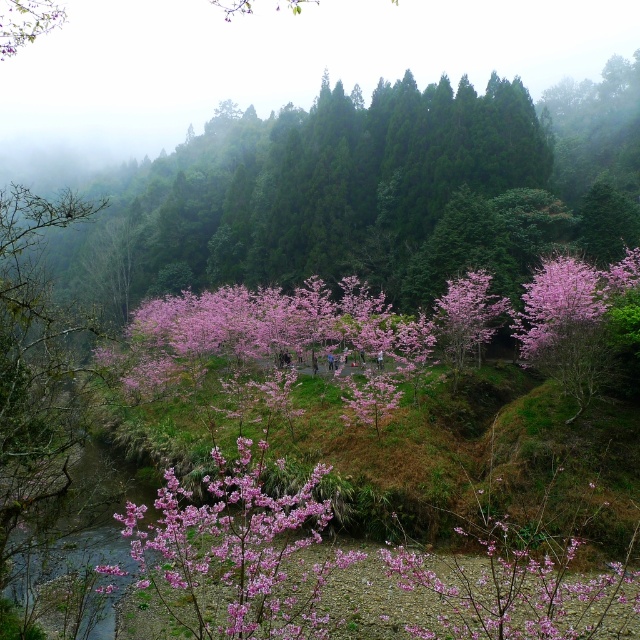
Can you confirm if pink matte flowers at center is positioned above pink matte flower at center?

No.

Does point (202, 637) lie behind point (196, 563)?

No, it is in front of (196, 563).

Find the location of a particular element. pink matte flowers at center is located at coordinates [x=340, y=576].